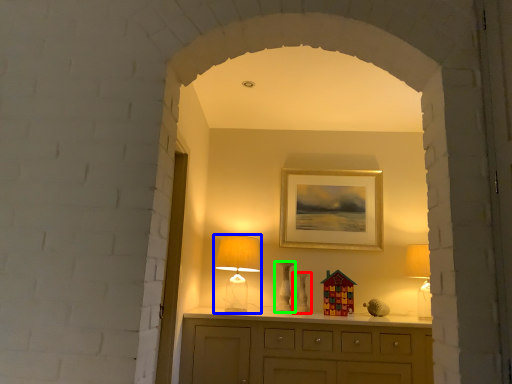
Question: Estimate the real-world distances between objects in this image. Which object is farther from vase (highlighted by a red box), table lamp (highlighted by a blue box) or vase (highlighted by a green box)?

Choices:
 (A) table lamp
 (B) vase

Answer: (A)